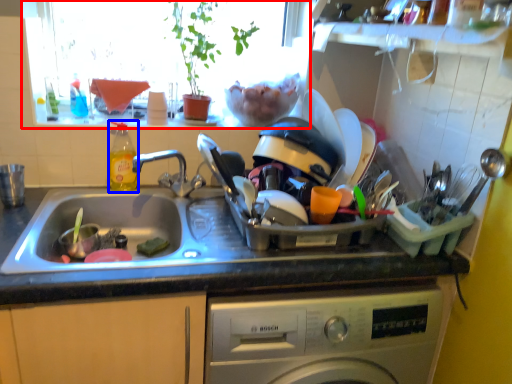
Question: Which of the following is the closest to the observer, window screen (highlighted by a red box) or bottle (highlighted by a blue box)?

Choices:
 (A) window screen
 (B) bottle

Answer: (A)